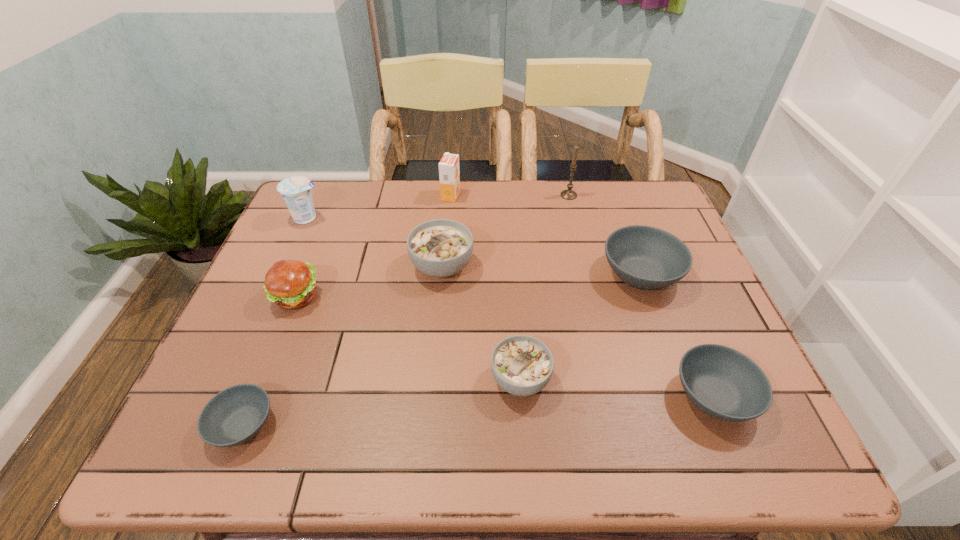
Image resolution: width=960 pixels, height=540 pixels. I want to click on the tallest object, so click(569, 194).

Identify the location of the seventh object from left to right. The height and width of the screenshot is (540, 960). (569, 194).

You are a GUI agent. You are given a task and a screenshot of the screen. Output one action in this format:
    pyautogui.click(x=<x>, y=<y>)
    Task: Click on the second tallest object
    The height and width of the screenshot is (540, 960).
    Given the screenshot: What is the action you would take?
    pyautogui.click(x=449, y=174)

Find the location of a particular element. The height and width of the screenshot is (540, 960). orange orange juice is located at coordinates (449, 174).

Find the location of a particular element. This screenshot has height=540, width=960. blue yogurt is located at coordinates pyautogui.click(x=296, y=192).

What are the coordinates of `the third farthest object` in the screenshot? It's located at (296, 192).

Identify the location of the fourth soup bowl from right to left. Image resolution: width=960 pixels, height=540 pixels. (440, 248).

Where is `the farther white soup bowl`? the farther white soup bowl is located at coordinates (440, 248).

The image size is (960, 540). What are the coordinates of `hamburger` in the screenshot? It's located at (x=291, y=284).

Locate an element on the screen. the biggest gray soup bowl is located at coordinates (644, 257).